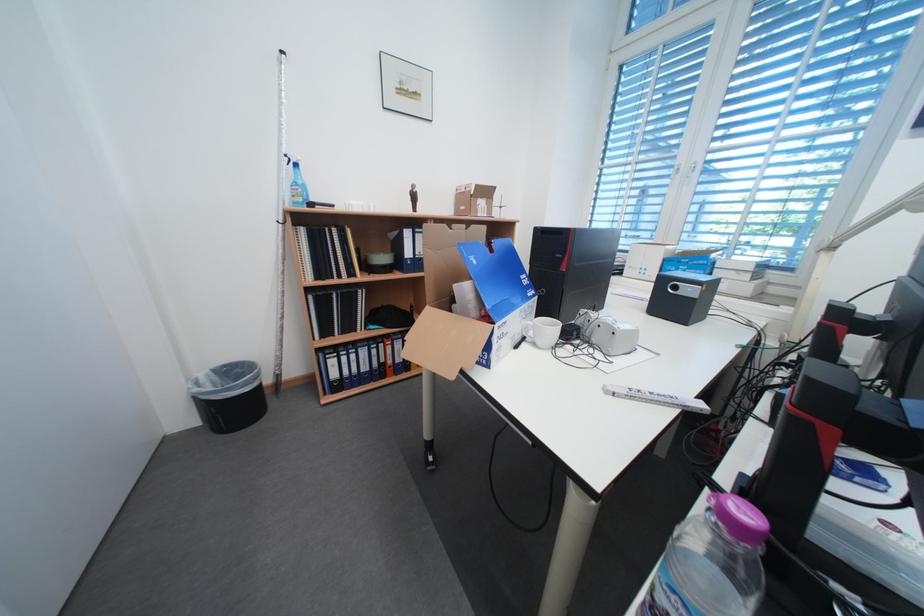
Locate an element on the screen. The image size is (924, 616). white mug handle is located at coordinates (527, 329).